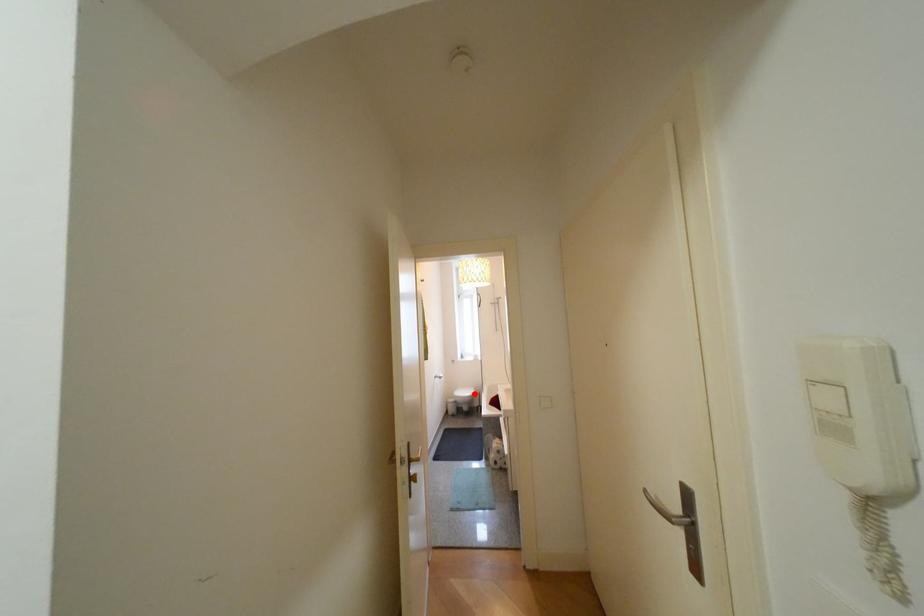
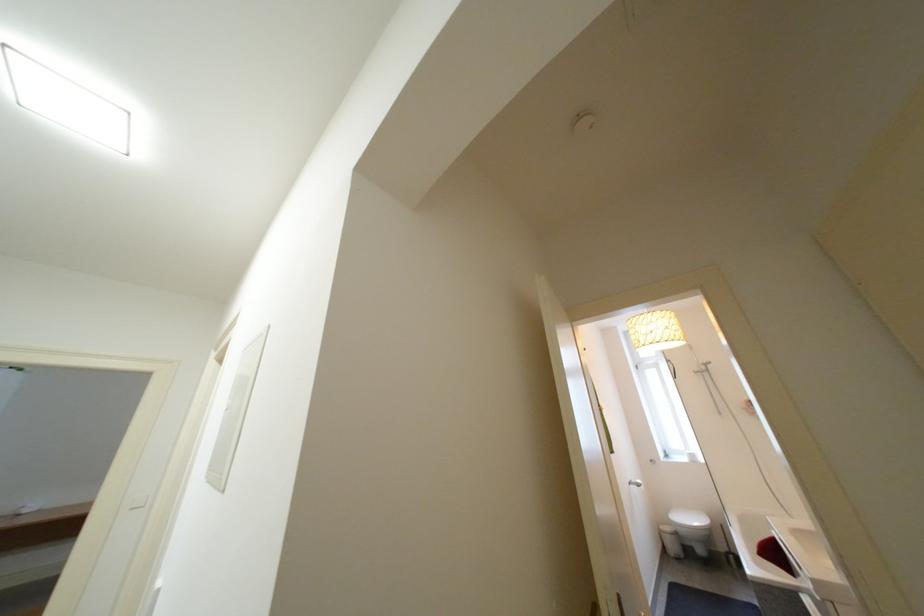
The point at the highlighted location is marked in the first image. Where is the corresponding point in the second image?

(699, 521)